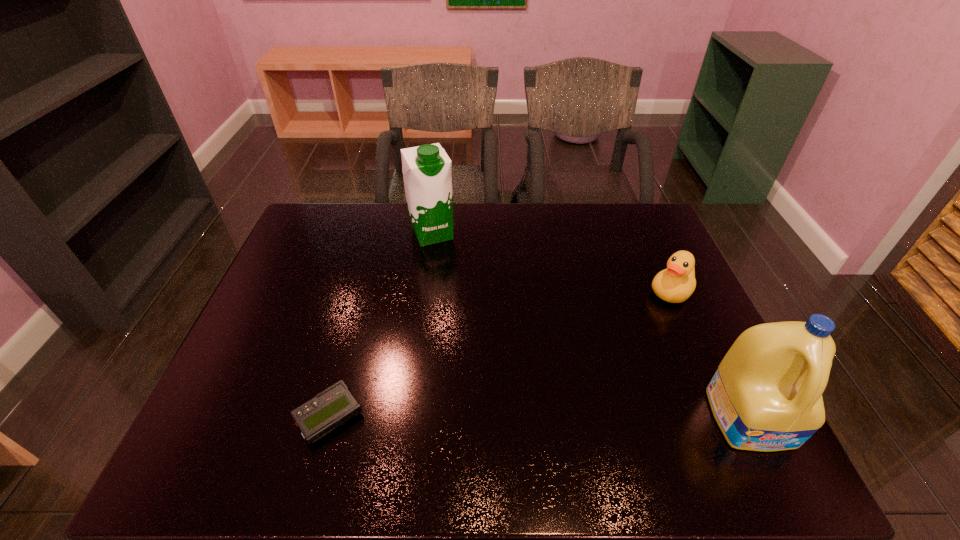
In order to click on vacant area that satisfies the following two spatial constraints: 1. on the back side of the shortest object; 2. on the right side of the second object from left to right in this screenshot , I will do pos(379,233).

The height and width of the screenshot is (540, 960). Find the location of `blank area in the image that satisfies the following two spatial constraints: 1. on the back side of the duck; 2. on the left side of the leftmost object`. blank area in the image that satisfies the following two spatial constraints: 1. on the back side of the duck; 2. on the left side of the leftmost object is located at coordinates (364, 292).